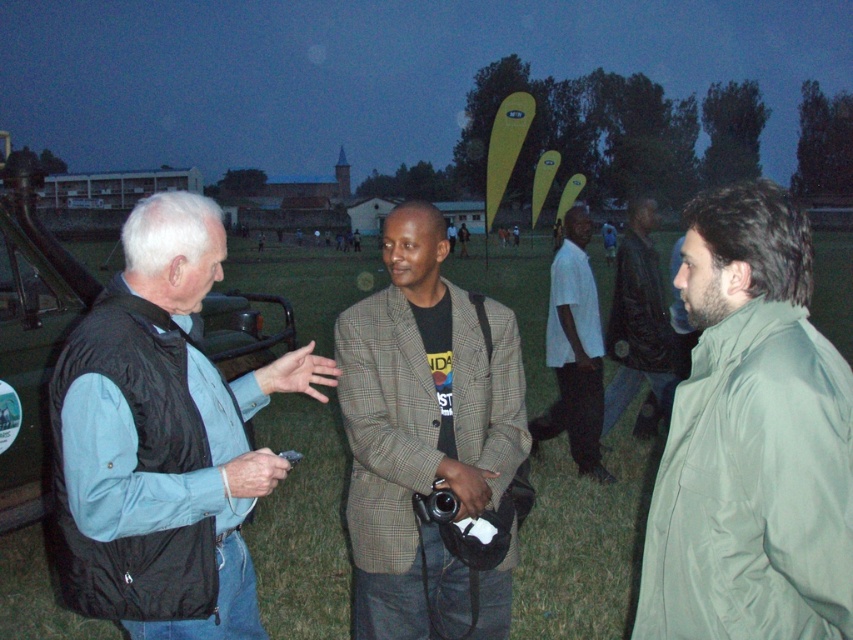
Is white cotton shirt at center smaller than leather jacket at center?

Indeed, white cotton shirt at center has a smaller size compared to leather jacket at center.

Is white cotton shirt at center wider than leather jacket at center?

No.

Is point (570, 253) less distant than point (631, 328)?

That is True.

I want to click on white cotton shirt at center, so click(573, 349).

Is point (166, 250) farther from camera compared to point (590, 420)?

No, it is in front of (590, 420).

Where is `black synthetic vest at left`? This screenshot has width=853, height=640. black synthetic vest at left is located at coordinates (173, 433).

Where is `black synthetic vest at left`? This screenshot has height=640, width=853. black synthetic vest at left is located at coordinates (173, 433).

Does black synthetic vest at left appear on the right side of plaid fabric blazer at center?

In fact, black synthetic vest at left is to the left of plaid fabric blazer at center.

Does point (67, 460) come in front of point (434, 540)?

That is True.

Locate an element on the screen. This screenshot has width=853, height=640. black synthetic vest at left is located at coordinates (173, 433).